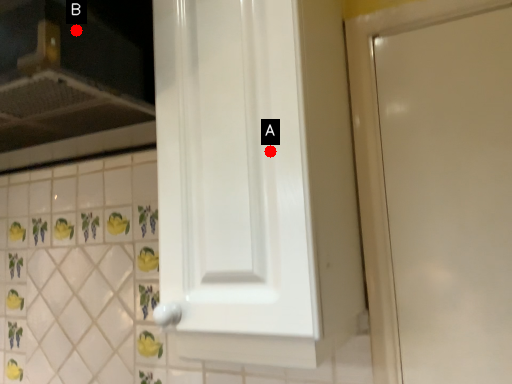
Question: Two points are circled on the image, labeled by A and B beside each circle. Which of the following is the farthest from the observer?

Choices:
 (A) A is further
 (B) B is further

Answer: (B)